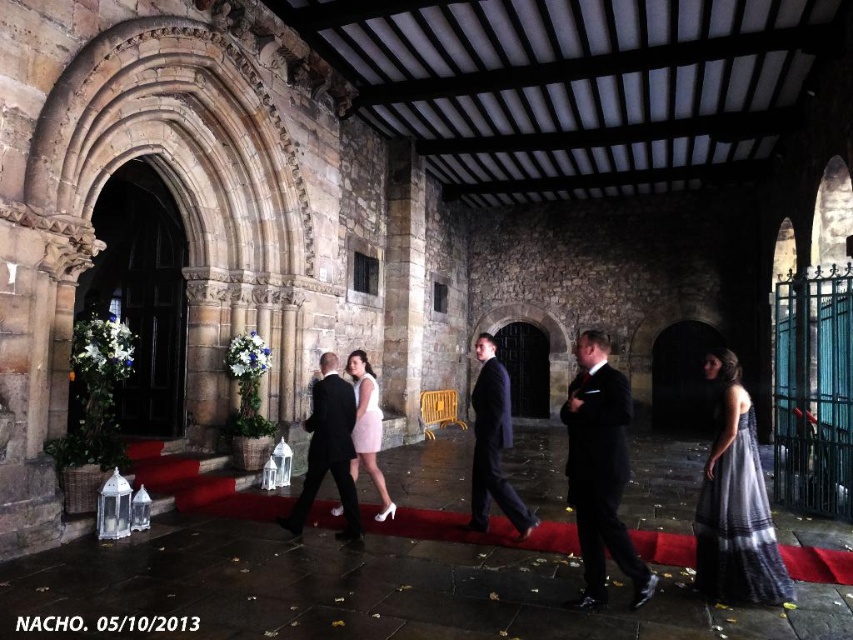
Question: Estimate the real-world distances between objects in this image. Which object is farther from the black satin suit at center?

Choices:
 (A) pink satin dress at center
 (B) pale pink satin dress at center

Answer: (B)

Question: Can you confirm if gray striped fabric dress at right is wider than pink satin dress at center?

Choices:
 (A) no
 (B) yes

Answer: (B)

Question: Does shiny black suit at center appear on the left side of dark suit at center?

Choices:
 (A) no
 (B) yes

Answer: (B)

Question: Is black satin suit at center wider than pink satin dress at center?

Choices:
 (A) yes
 (B) no

Answer: (A)

Question: Which of these objects is positioned closest to the pink satin dress at center?

Choices:
 (A) dark suit at center
 (B) black satin suit at center

Answer: (A)

Question: Considering the real-world distances, which object is farthest from the dark suit at center?

Choices:
 (A) pink satin dress at center
 (B) gray striped fabric dress at right
 (C) black satin suit at center
 (D) shiny black suit at center

Answer: (B)